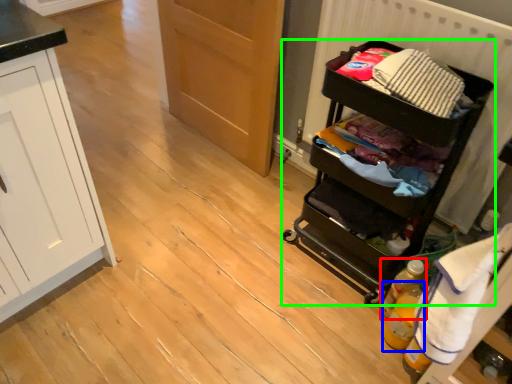
Question: Which object is the farthest from bottle (highlighted by a red box)? Choose among these: bottle (highlighted by a blue box) or furniture (highlighted by a green box).

Choices:
 (A) bottle
 (B) furniture

Answer: (B)